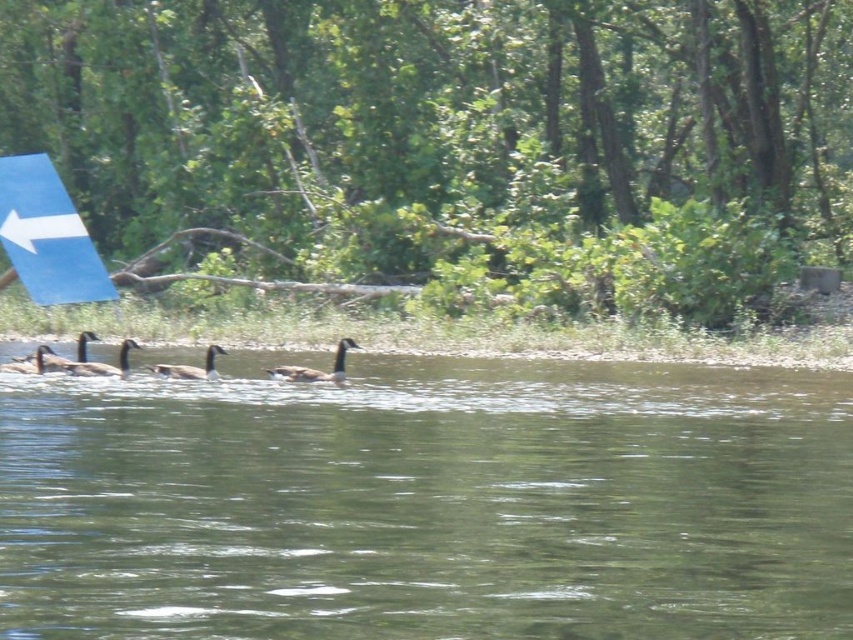
Question: Is green smooth water at center thinner than dark brown duck at center?

Choices:
 (A) no
 (B) yes

Answer: (A)

Question: Which of the following is the closest to the observer?

Choices:
 (A) brown feathered duck at center
 (B) brown matte duck at center
 (C) green smooth water at center
 (D) dark brown duck at center

Answer: (C)

Question: Which of the following is the farthest from the observer?

Choices:
 (A) (39, 362)
 (B) (199, 371)
 (C) (80, 364)
 (D) (318, 376)

Answer: (A)

Question: Is green smooth water at center bigger than brown feathered duck at lower left?

Choices:
 (A) yes
 (B) no

Answer: (A)

Question: Which object is closer to the camera taking this photo?

Choices:
 (A) green smooth water at center
 (B) dark brown duck at center
 (C) brown feathered duck at center
 (D) brown feathered duck at lower left

Answer: (A)

Question: Does green smooth water at center appear over brown matte duck at center?

Choices:
 (A) yes
 (B) no

Answer: (B)